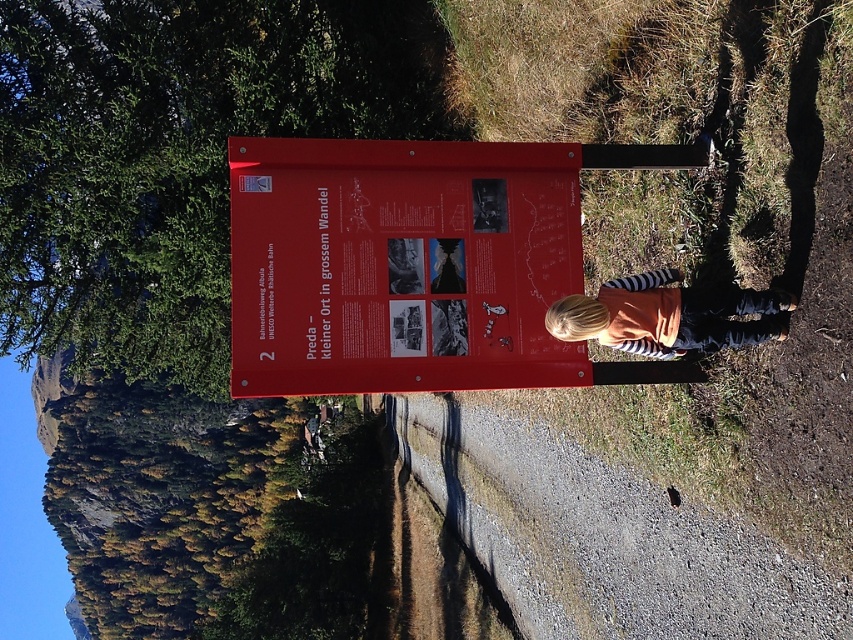
You are standing in front of the red informational sign about Preda. You notice two points marked on the sign at coordinates point (351, 214) and point (569, 307). Which point is closer to you?

Point (351, 214) is further to the camera than point (569, 307), so the point closer to you is point (569, 307).

You are standing at the point marked as point (399,266) and want to find the red matte sign at center. Which direction should you move to locate it?

The red matte sign at center is located exactly at point (399,266), so you are already at the location of the red matte sign at center.